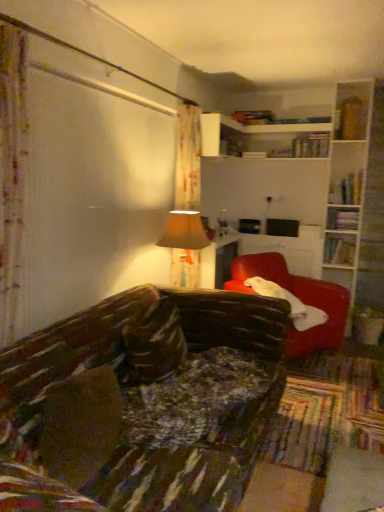
Question: Considering the relative sizes of matte red armchair at right and hardcover book at upper right, arranged as the third book when viewed from the top, in the image provided, is matte red armchair at right thinner than hardcover book at upper right, arranged as the third book when viewed from the top,?

Choices:
 (A) yes
 (B) no

Answer: (B)

Question: Is matte red armchair at right placed right next to hardcover book at upper right, arranged as the third book when viewed from the top?

Choices:
 (A) yes
 (B) no

Answer: (B)

Question: Is matte red armchair at right in front of hardcover book at upper right, which appears as the second book when viewed from the left?

Choices:
 (A) no
 (B) yes

Answer: (B)

Question: Is hardcover book at upper right, the 2th book positioned from the bottom, inside matte red armchair at right?

Choices:
 (A) no
 (B) yes

Answer: (A)

Question: Would you say matte red armchair at right is a long distance from hardcover book at upper right, the 2th book positioned from the bottom?

Choices:
 (A) yes
 (B) no

Answer: (A)

Question: Considering the relative sizes of matte red armchair at right and hardcover book at upper right, which appears as the second book when viewed from the left, in the image provided, is matte red armchair at right wider than hardcover book at upper right, which appears as the second book when viewed from the left,?

Choices:
 (A) yes
 (B) no

Answer: (A)

Question: Considering the relative sizes of beige fabric lampshade at center and hardcover book at upper right, the 3th book in the right-to-left sequence, in the image provided, is beige fabric lampshade at center wider than hardcover book at upper right, the 3th book in the right-to-left sequence,?

Choices:
 (A) no
 (B) yes

Answer: (B)

Question: Can you confirm if beige fabric lampshade at center is smaller than hardcover book at upper right, the 3th book in the right-to-left sequence?

Choices:
 (A) yes
 (B) no

Answer: (B)

Question: Are beige fabric lampshade at center and hardcover book at upper right, arranged as the third book when viewed from the top, far apart?

Choices:
 (A) no
 (B) yes

Answer: (B)

Question: Is beige fabric lampshade at center taller than hardcover book at upper right, the 3th book in the right-to-left sequence?

Choices:
 (A) yes
 (B) no

Answer: (A)

Question: Could you tell me if beige fabric lampshade at center is turned towards hardcover book at upper right, the 3th book in the right-to-left sequence?

Choices:
 (A) no
 (B) yes

Answer: (A)

Question: Is beige fabric lampshade at center facing away from hardcover book at upper right, which appears as the second book when viewed from the left?

Choices:
 (A) yes
 (B) no

Answer: (B)

Question: Does hardcover book at upper right, the 2th book positioned from the bottom, have a greater width compared to beige fabric lampshade at center?

Choices:
 (A) no
 (B) yes

Answer: (A)